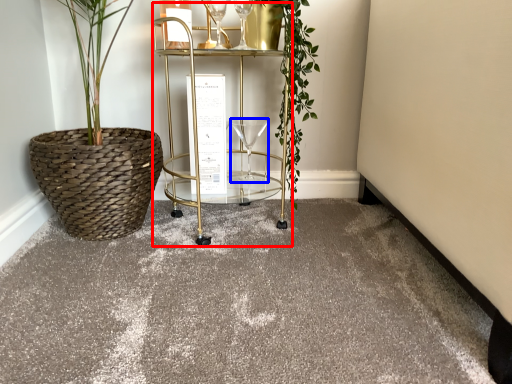
Question: Which object is further to the camera taking this photo, cart (highlighted by a red box) or wine glass (highlighted by a blue box)?

Choices:
 (A) cart
 (B) wine glass

Answer: (B)